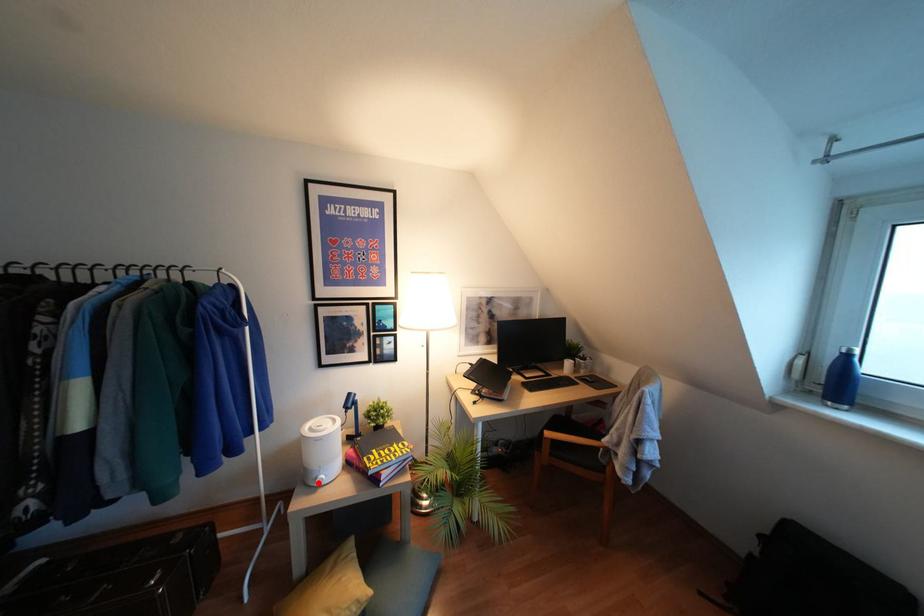
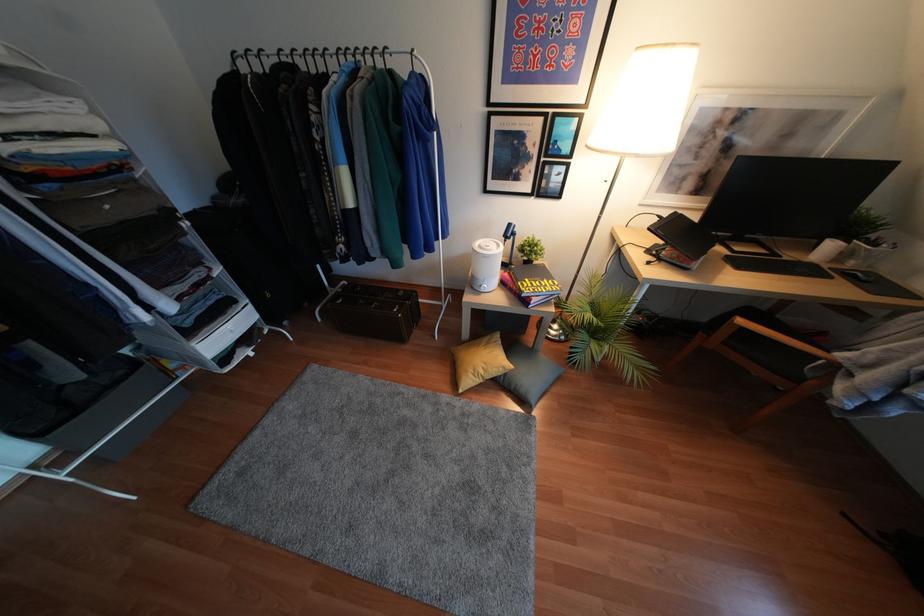
Where in the second image is the point corresponding to the highlighted location from the first image?

(481, 290)